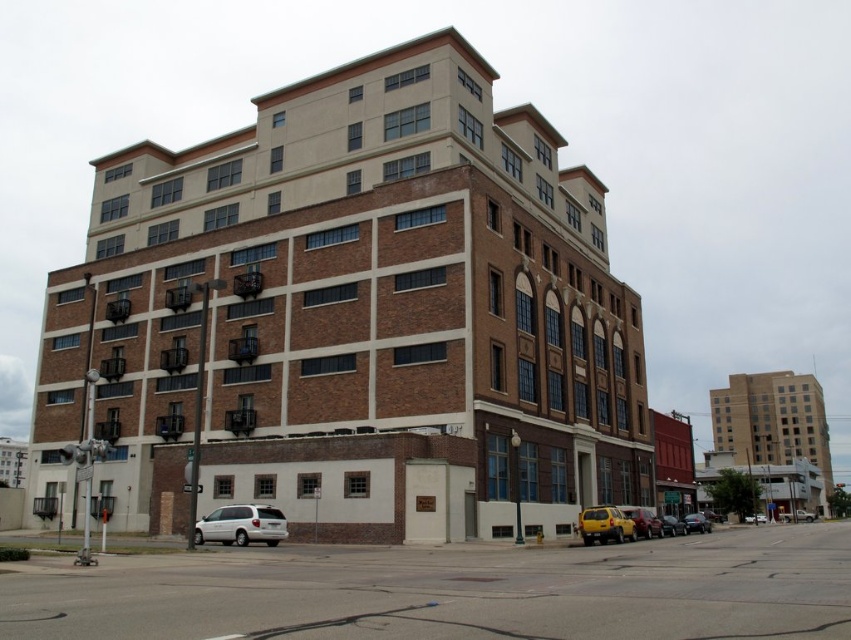
You are standing in front of the building and looking at its facade. There are two points marked on the image. One is at coordinate point [637,579] and the other is at point [273,508]. Which point is closer to you?

Point [637,579] is closer to the camera than point [273,508].

Based on the photo, you are a pedestrian standing on the concrete sidewalk at lower center. You want to cross the street to reach a store across the road. Is the shiny black sedan at center blocking your path?

The concrete sidewalk at lower center is in front of the shiny black sedan at center, meaning the sedan is between you and the street. Therefore, the shiny black sedan at center is blocking your path.

You are a pedestrian standing on the sidewalk in front of the building. You need to walk to the entrance of the building, which is located to the right of the white matte van at lower left. Can you walk directly from the concrete sidewalk at lower center to the entrance without crossing the street?

The concrete sidewalk at lower center is to the right of the white matte van at lower left, so the entrance to the building is located to the right of the van. Since the sidewalk is already positioned to the right of the van, you can walk directly from the concrete sidewalk at lower center to the entrance without needing to cross the street.